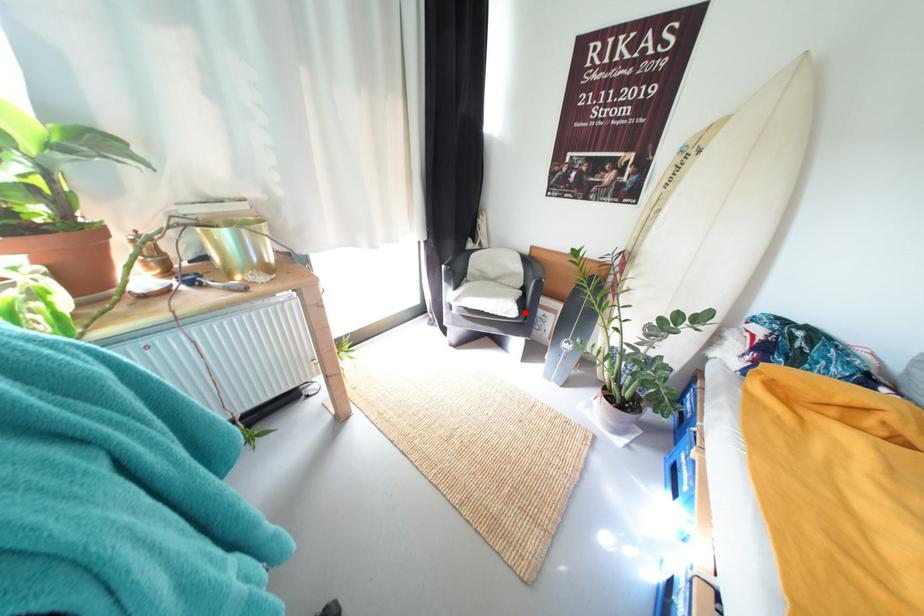
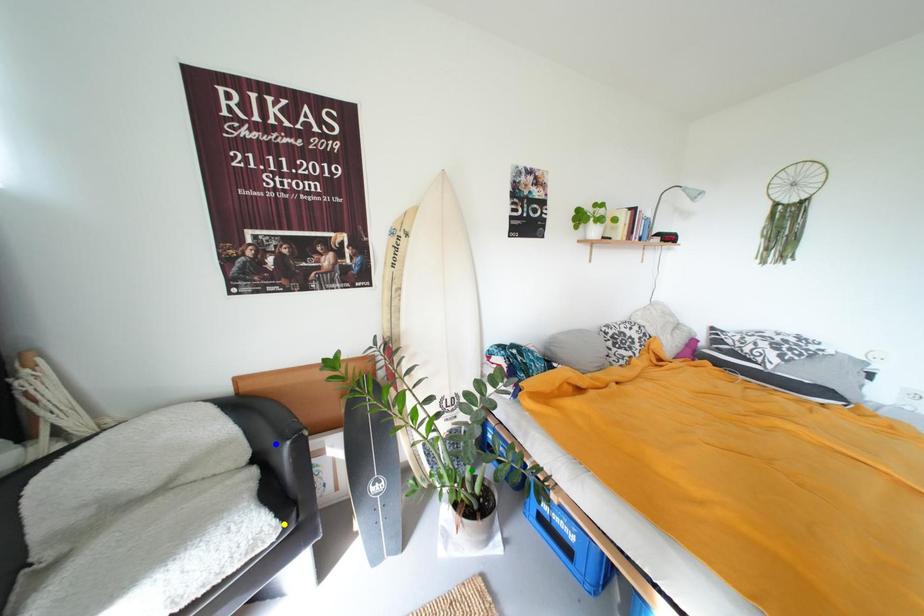
Question: I am providing you with two images of the same scene from different viewpoints. A red point is marked on the first image. You are given multiple points on the second image. Which mark in image 2 goes with the point in image 1?

Choices:
 (A) blue point
 (B) yellow point
 (C) green point

Answer: (B)